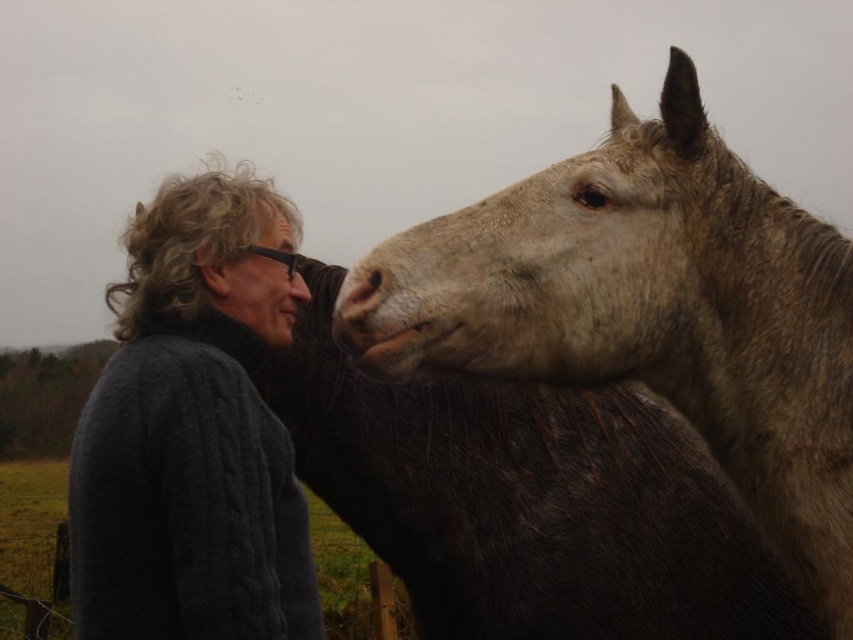
What color is the fur at the point located at coordinates [648,310] in the image?

The fur at the point located at coordinates [648,310] is grayish brown.